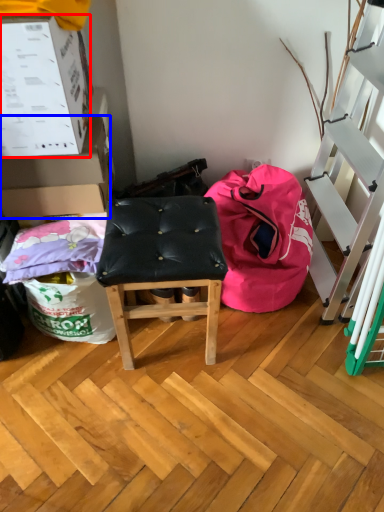
Question: Which object appears farthest to the camera in this image, box (highlighted by a red box) or box (highlighted by a blue box)?

Choices:
 (A) box
 (B) box

Answer: (B)